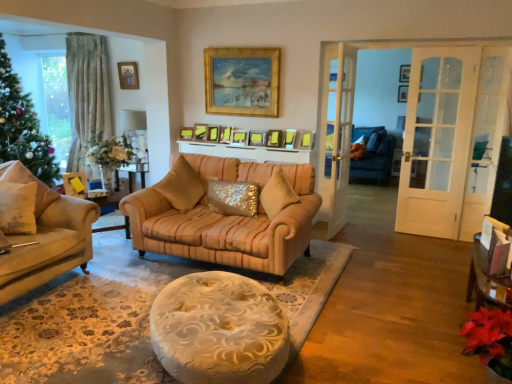
Question: Does matte white lampshade at upper left have a lesser width compared to matte gold picture frame at center, which is the 9th picture frame in back-to-front order?

Choices:
 (A) yes
 (B) no

Answer: (B)

Question: Does matte white lampshade at upper left have a greater width compared to matte gold picture frame at center, the 5th picture frame viewed from the right?

Choices:
 (A) no
 (B) yes

Answer: (B)

Question: Is matte white lampshade at upper left in contact with matte gold picture frame at center, the eighth picture frame viewed from the left?

Choices:
 (A) yes
 (B) no

Answer: (B)

Question: Does matte white lampshade at upper left have a smaller size compared to matte gold picture frame at center, which is the fourth picture frame in front-to-back order?

Choices:
 (A) no
 (B) yes

Answer: (A)

Question: Would you say matte white lampshade at upper left is outside matte gold picture frame at center, the 5th picture frame viewed from the right?

Choices:
 (A) no
 (B) yes

Answer: (B)

Question: Is matte white lampshade at upper left in front of matte gold picture frame at center, which is the 9th picture frame in back-to-front order?

Choices:
 (A) yes
 (B) no

Answer: (B)

Question: Can you confirm if matte wooden picture frame at center, marked as the 10th picture frame in a left-to-right arrangement, is wider than matte gold picture frame at center, positioned as the eighth picture frame in right-to-left order?

Choices:
 (A) yes
 (B) no

Answer: (B)

Question: Is matte wooden picture frame at center, the 2th picture frame when ordered from front to back, looking in the opposite direction of matte gold picture frame at center, the sixth picture frame positioned from the front?

Choices:
 (A) no
 (B) yes

Answer: (A)

Question: Are matte wooden picture frame at center, marked as the 10th picture frame in a left-to-right arrangement, and matte gold picture frame at center, acting as the 5th picture frame starting from the left, far apart?

Choices:
 (A) no
 (B) yes

Answer: (A)

Question: Is matte wooden picture frame at center, the 3th picture frame positioned from the right, oriented towards matte gold picture frame at center, the sixth picture frame positioned from the front?

Choices:
 (A) no
 (B) yes

Answer: (A)

Question: Can you confirm if matte wooden picture frame at center, the 11th picture frame from the back, is taller than matte gold picture frame at center, the sixth picture frame positioned from the front?

Choices:
 (A) no
 (B) yes

Answer: (A)

Question: Is matte wooden picture frame at center, the 2th picture frame when ordered from front to back, closer to camera compared to matte gold picture frame at center, the seventh picture frame in the back-to-front sequence?

Choices:
 (A) no
 (B) yes

Answer: (B)

Question: Is sparkly gold pillow at center, the second pillow positioned from the right, to the right of matte gold picture frame at center, which is the eleventh picture frame in right-to-left order, from the viewer's perspective?

Choices:
 (A) yes
 (B) no

Answer: (A)